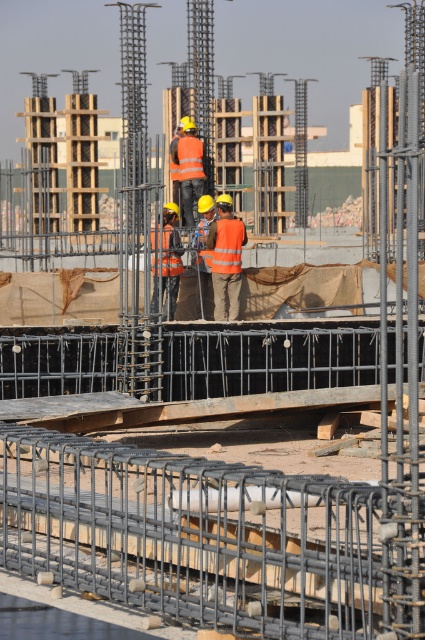
Question: Can you confirm if reflective orange vest at center is bigger than orange reflective vest at center?

Choices:
 (A) yes
 (B) no

Answer: (A)

Question: Which point appears closest to the camera in this image?

Choices:
 (A) (155, 307)
 (B) (223, 273)

Answer: (A)

Question: Can you confirm if reflective orange vest at center is positioned to the left of orange reflective vest at center?

Choices:
 (A) no
 (B) yes

Answer: (A)

Question: Which point is farther from the camera taking this photo?

Choices:
 (A) (218, 262)
 (B) (155, 248)

Answer: (A)

Question: Is the position of reflective orange vest at center less distant than that of orange reflective vest at center?

Choices:
 (A) no
 (B) yes

Answer: (A)